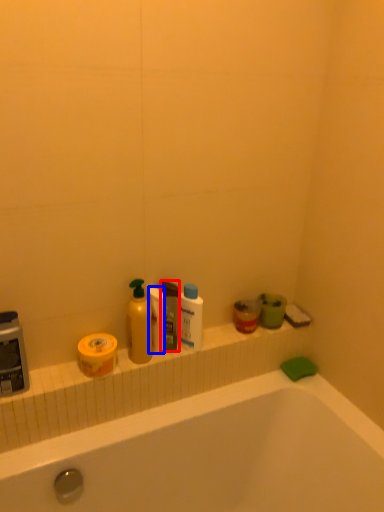
Question: Which of the following is the closest to the observer, mouthwash (highlighted by a red box) or toilet paper (highlighted by a blue box)?

Choices:
 (A) mouthwash
 (B) toilet paper

Answer: (B)